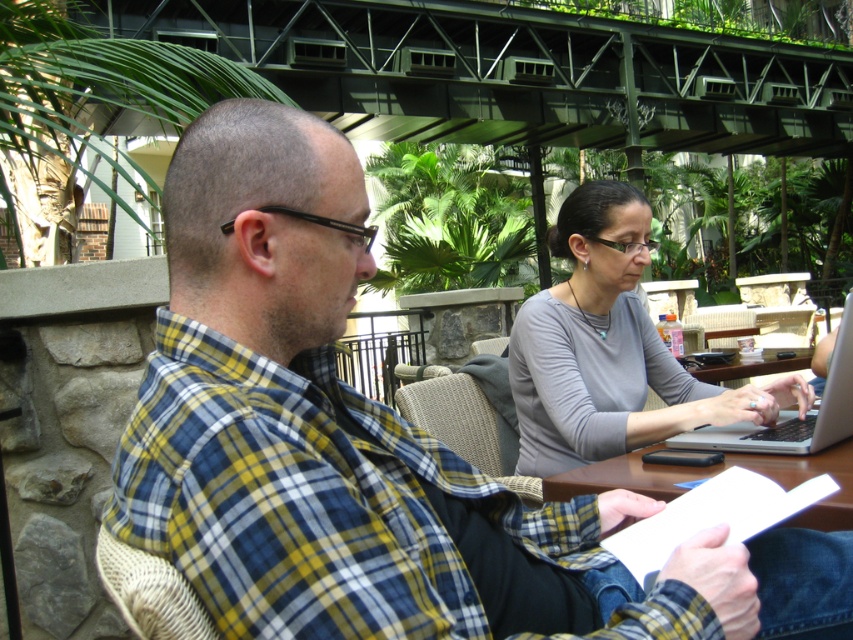
You are a customer in the cafe and want to place your coffee cup on the table. The table has a coordinate system where the bottom left corner is the origin. The gray matte shirt at center is located at point [610,348]. If you want to place your coffee cup 20 cm to the right of the gray matte shirt at center, where should you place it?

To place the coffee cup 20 cm to the right of the gray matte shirt at center located at point [610,348], you would adjust the x coordinate by adding 20 cm. The new coordinates would be approximately 0.745, 0.716.